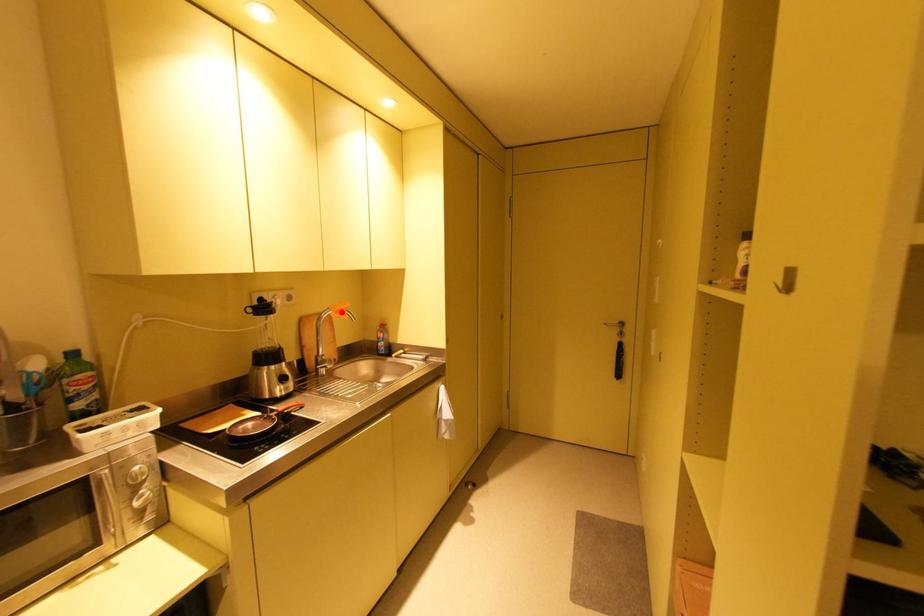
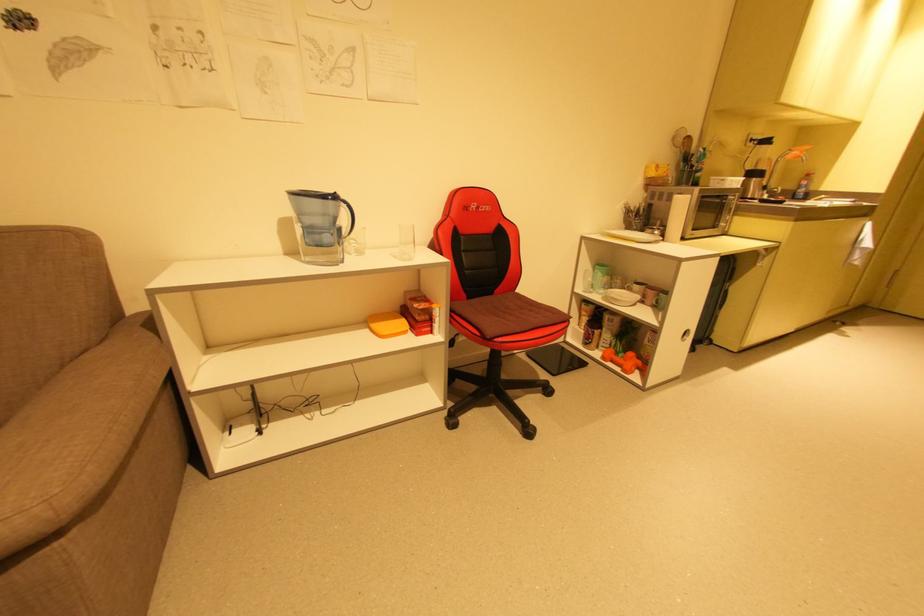
The point at the highlighted location is marked in the first image. Where is the corresponding point in the second image?

(805, 152)